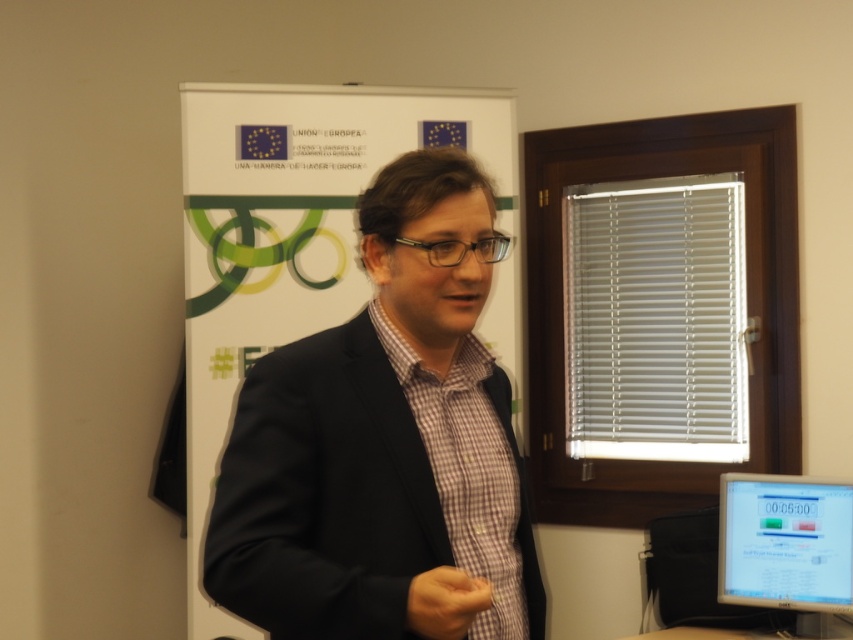
You are standing in the conference room and want to move from point A to point B. Point A is located at coordinate point(241, 97) and point B is at coordinate(746, 532). Which point is closer to you?

Point A at coordinate(241, 97) is closer to you since it is further to the viewer than point B at coordinate(746, 532).